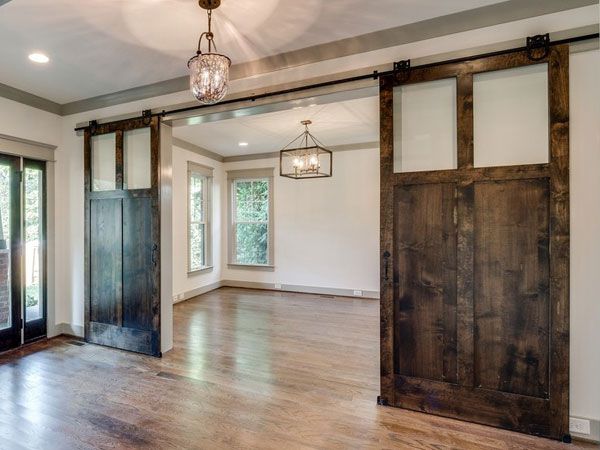
Where is `hanging lights`? hanging lights is located at coordinates (306, 134), (208, 33).